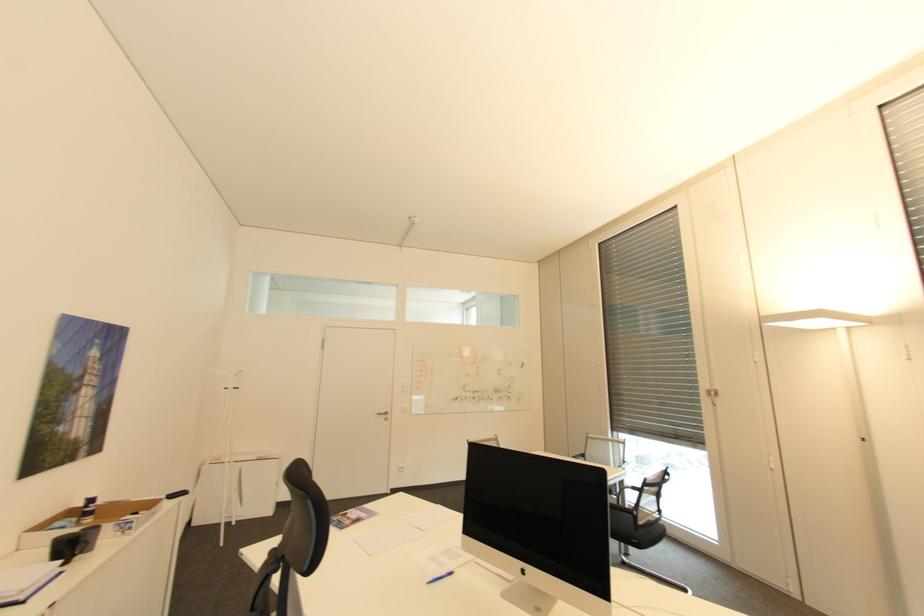
Identify the location of dark blue cup. (541, 523).